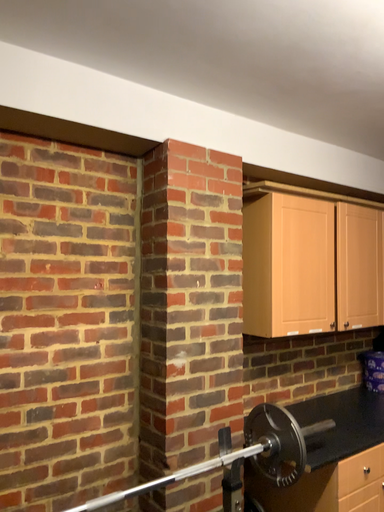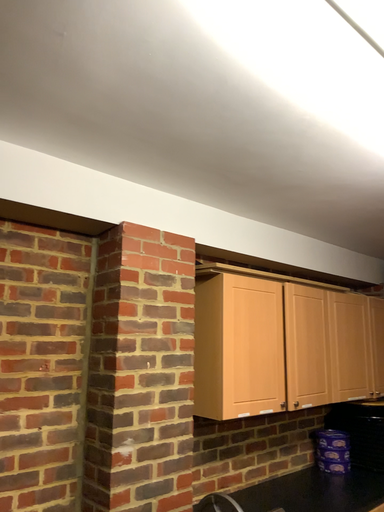
Question: How did the camera likely rotate when shooting the video?

Choices:
 (A) rotated upward
 (B) rotated downward

Answer: (A)